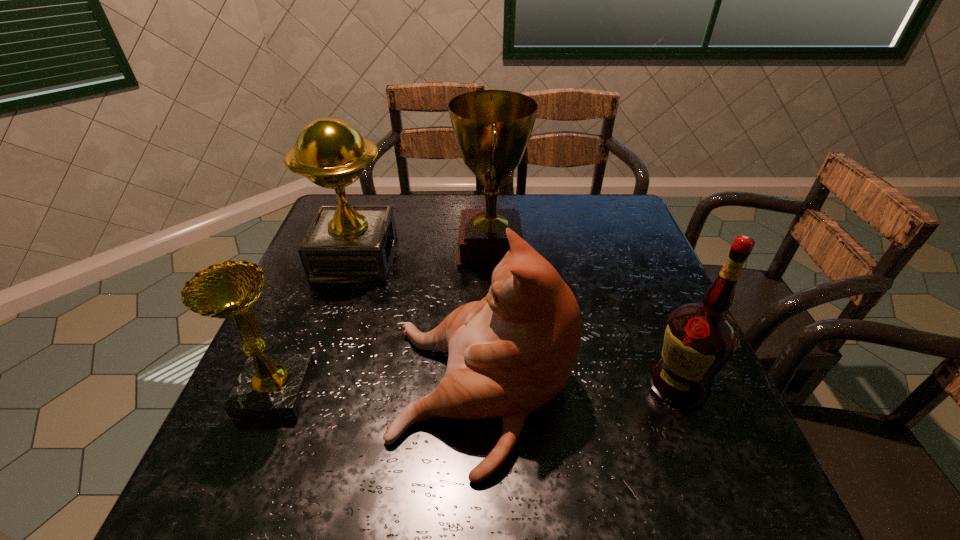
The height and width of the screenshot is (540, 960). Identify the location of vacant region at the left edge of the desktop. (308, 313).

You are a GUI agent. You are given a task and a screenshot of the screen. Output one action in this format:
    pyautogui.click(x=<x>, y=<y>)
    Task: Click on the free space at the right edge of the desktop
    This screenshot has height=540, width=960.
    Given the screenshot: What is the action you would take?
    pyautogui.click(x=696, y=445)

Find the location of `free region at the near left corner`. free region at the near left corner is located at coordinates (233, 507).

The image size is (960, 540). In the image, there is a desktop. Find the location of `vacant space at the far right corner`. vacant space at the far right corner is located at coordinates (596, 218).

Locate an element on the screen. The width and height of the screenshot is (960, 540). free location at the near right corner is located at coordinates point(710,463).

Locate an element on the screen. empty location between the shortest award and the rightmost award is located at coordinates (383, 320).

Find the location of a particular element. The height and width of the screenshot is (540, 960). blank region between the cat and the shortest award is located at coordinates (379, 394).

You are a GUI agent. You are given a task and a screenshot of the screen. Output one action in this format:
    pyautogui.click(x=<x>, y=<y>)
    Task: Click on the object identified as the closest to the nearest award
    Image resolution: width=960 pixels, height=540 pixels.
    Given the screenshot: What is the action you would take?
    pyautogui.click(x=512, y=352)

I want to click on the second closest object to the shortest object, so click(x=345, y=243).

Identify the location of award that stands as the closest to the cat. This screenshot has width=960, height=540. (492, 128).